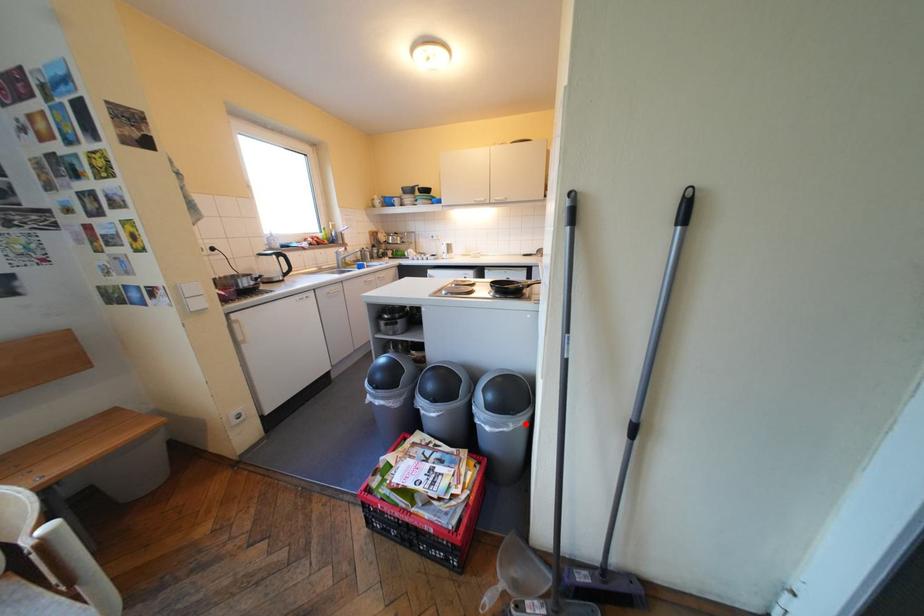
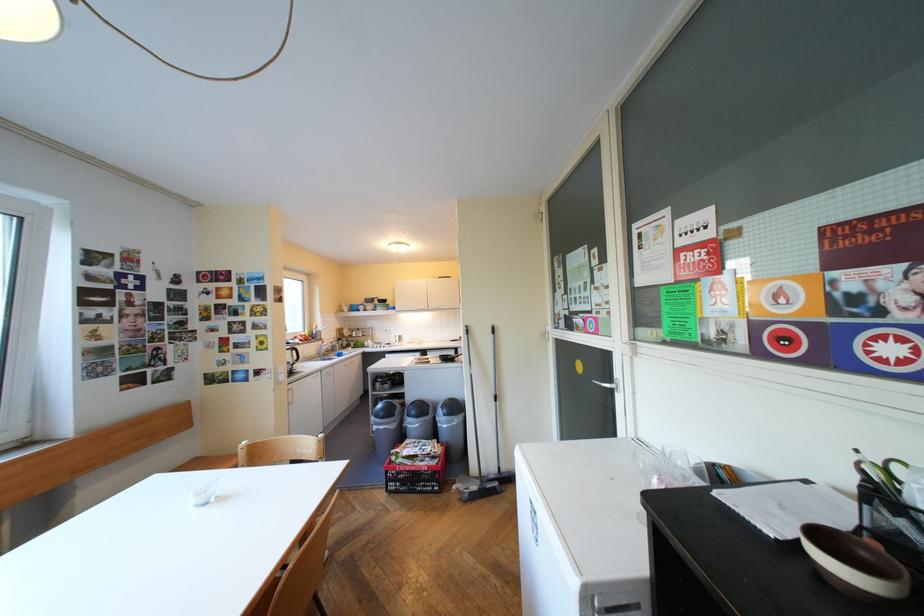
Locate, in the second image, the point that corresponds to the highlighted location in the first image.

(469, 419)